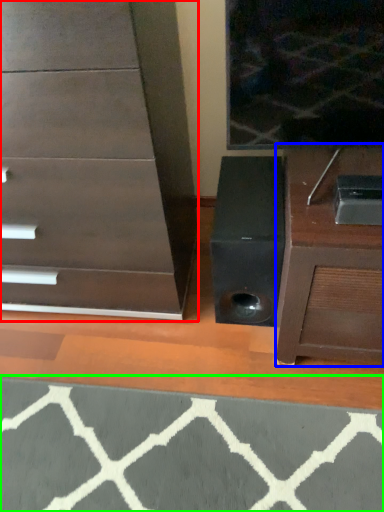
Question: Estimate the real-world distances between objects in this image. Which object is closer to chest of drawers (highlighted by a red box), furniture (highlighted by a blue box) or doormat (highlighted by a green box)?

Choices:
 (A) furniture
 (B) doormat

Answer: (A)